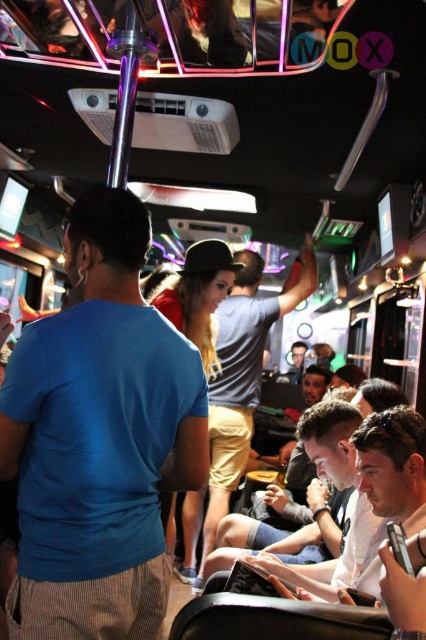
Question: Does matte black hat at center appear over smooth skin face at center?

Choices:
 (A) no
 (B) yes

Answer: (B)

Question: Which object is closer to the camera taking this photo?

Choices:
 (A) smooth skin face at center
 (B) matte black hat at center

Answer: (A)

Question: Estimate the real-world distances between objects in this image. Which object is closer to the blue cotton shirt at center?

Choices:
 (A) smooth skin face at center
 (B) matte black hat at center

Answer: (A)

Question: Which is nearer to the smooth skin face at center?

Choices:
 (A) blue cotton shirt at center
 (B) matte black hat at center

Answer: (A)

Question: Does blue cotton shirt at center appear on the left side of smooth skin face at center?

Choices:
 (A) yes
 (B) no

Answer: (A)

Question: Is blue cotton shirt at center closer to the viewer compared to matte black hat at center?

Choices:
 (A) no
 (B) yes

Answer: (B)